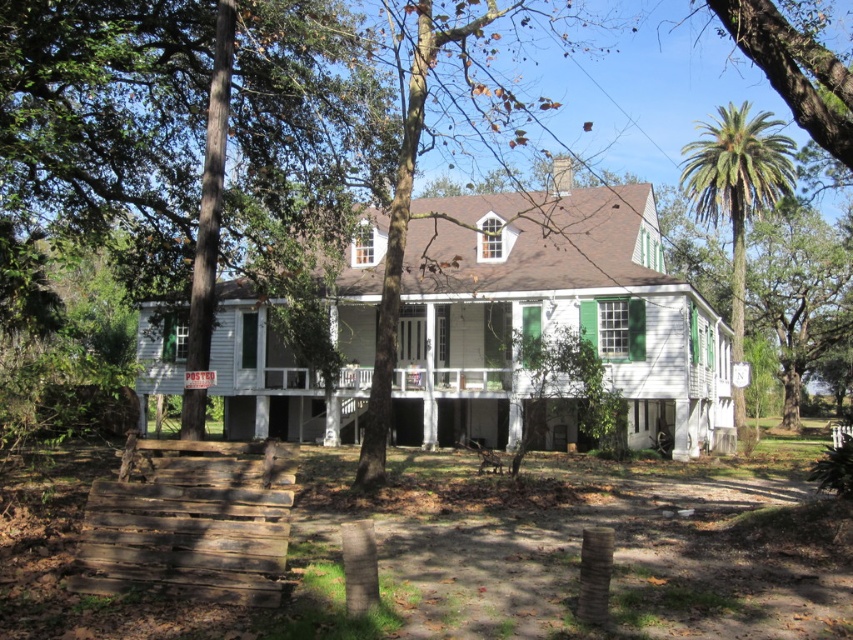
Question: From the image, what is the correct spatial relationship of weathered brown wood at lower left in relation to green leafy palm tree at right?

Choices:
 (A) above
 (B) below

Answer: (B)

Question: Is weathered brown wood at lower left further to the viewer compared to green wood tree at center?

Choices:
 (A) no
 (B) yes

Answer: (A)

Question: Which of the following is the farthest from the observer?

Choices:
 (A) (148, 468)
 (B) (302, 156)
 (C) (711, 180)
 (D) (463, 70)

Answer: (C)

Question: Which point is farther from the camera taking this photo?

Choices:
 (A) (505, 8)
 (B) (192, 525)

Answer: (A)

Question: Among these points, which one is nearest to the camera?

Choices:
 (A) (393, 365)
 (B) (723, 211)

Answer: (A)

Question: Is weathered brown wood at lower left positioned in front of green leafy palm tree at right?

Choices:
 (A) no
 (B) yes

Answer: (B)